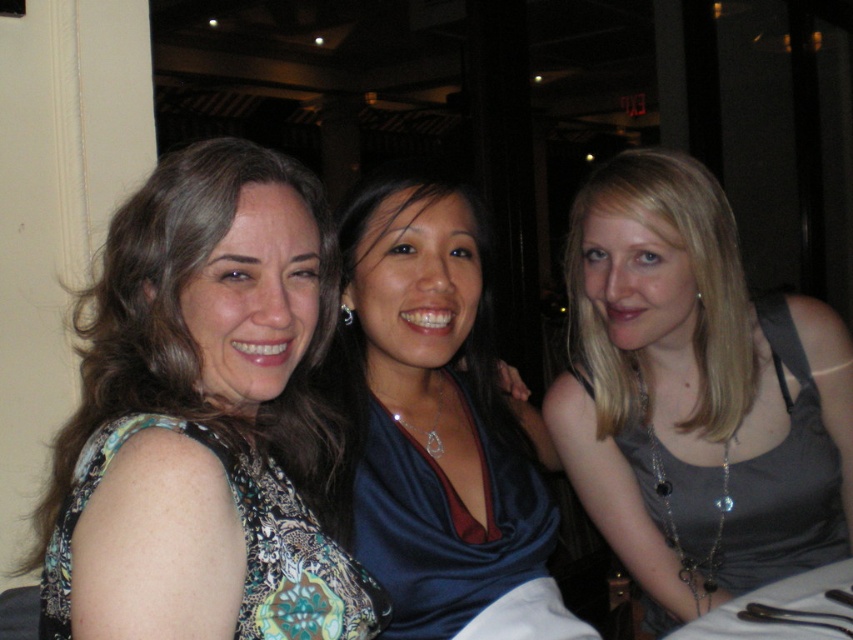
You are a photographer taking a group photo of the three women. You notice the patterned fabric dress at center and the blue satin dress at center. Which dress is positioned lower in the image?

The patterned fabric dress at center is below the blue satin dress at center, so the patterned fabric dress at center is positioned lower in the image.

You are a photographer setting up for a group photo. You need to ensure that the gray fabric tank top at right and the patterned fabric dress at center are within a 30 inch distance to frame them properly. Based on the scene description, can you confirm if they are close enough?

The gray fabric tank top at right is 26.49 inches from the patterned fabric dress at center, which is within the 30 inch requirement. Therefore, they are close enough to be framed properly.